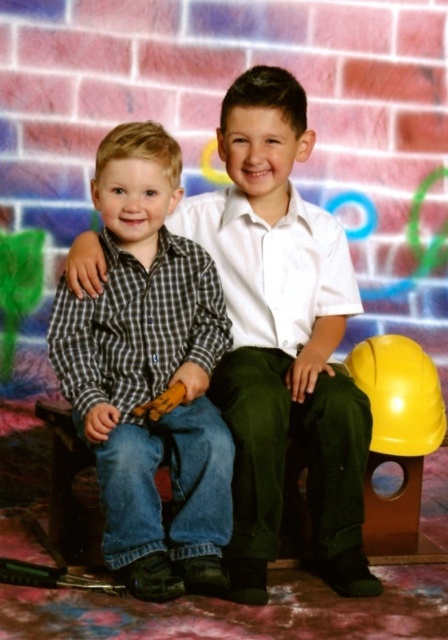
Is point (322, 285) closer to camera compared to point (142, 224)?

No, (322, 285) is behind (142, 224).

Who is positioned more to the right, checkered fabric shirt at center or checkered fabric shirt at left?

From the viewer's perspective, checkered fabric shirt at center appears more on the right side.

Find the location of a particular element. The height and width of the screenshot is (640, 448). checkered fabric shirt at center is located at coordinates (283, 339).

Find the location of a particular element. This screenshot has width=448, height=640. checkered fabric shirt at center is located at coordinates (283, 339).